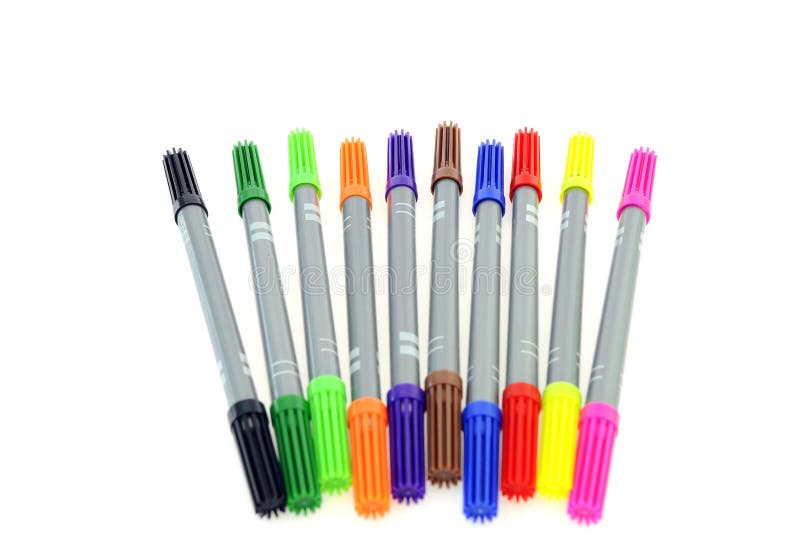
You are a GUI agent. You are given a task and a screenshot of the screen. Output one action in this format:
    pyautogui.click(x=<x>, y=<y>)
    Task: Click on the markers
    
    Given the screenshot: What is the action you would take?
    pyautogui.click(x=244, y=381), pyautogui.click(x=286, y=387), pyautogui.click(x=310, y=405), pyautogui.click(x=369, y=447), pyautogui.click(x=402, y=455), pyautogui.click(x=436, y=443), pyautogui.click(x=477, y=462), pyautogui.click(x=514, y=463), pyautogui.click(x=553, y=446), pyautogui.click(x=592, y=466)